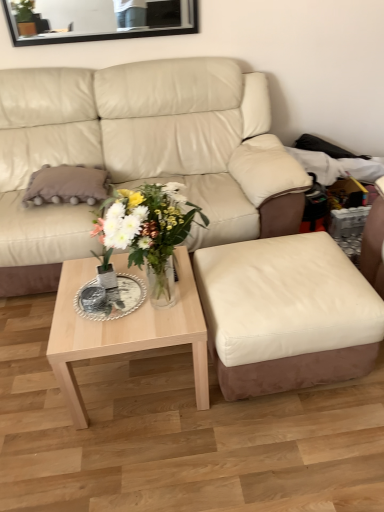
Where is `vacant space underneath clear glass vase at center (from a real-world perspective)`? vacant space underneath clear glass vase at center (from a real-world perspective) is located at coordinates (175, 304).